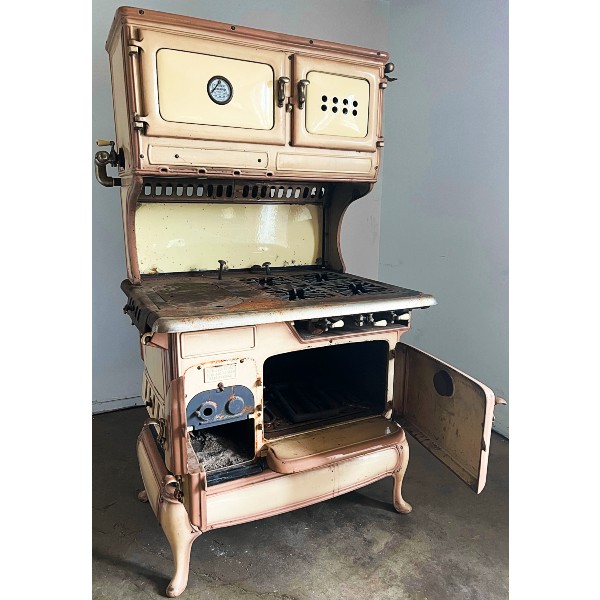
The width and height of the screenshot is (600, 600). I want to click on hinge, so click(x=391, y=357).